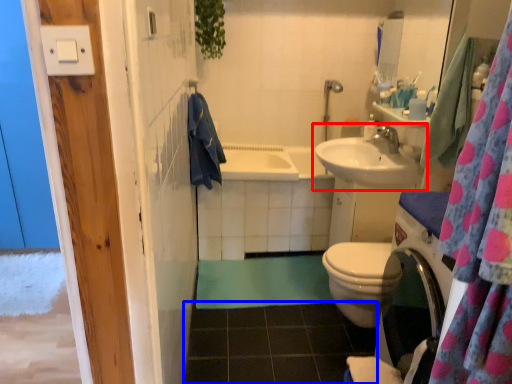
Question: Which point is closer to the camera, sink (highlighted by a red box) or tile (highlighted by a blue box)?

Choices:
 (A) sink
 (B) tile

Answer: (B)